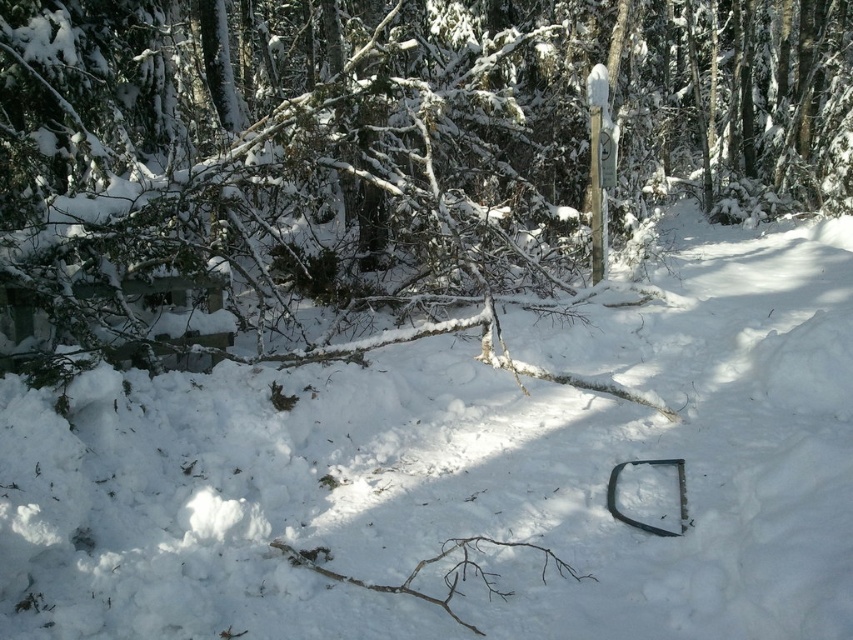
Can you confirm if white matte snow at center is smaller than snow-covered branch at center?

Correct, white matte snow at center occupies less space than snow-covered branch at center.

Between white matte snow at center and snow-covered branch at center, which one is positioned higher?

snow-covered branch at center is above.

Identify the location of white matte snow at center. Image resolution: width=853 pixels, height=640 pixels. (463, 474).